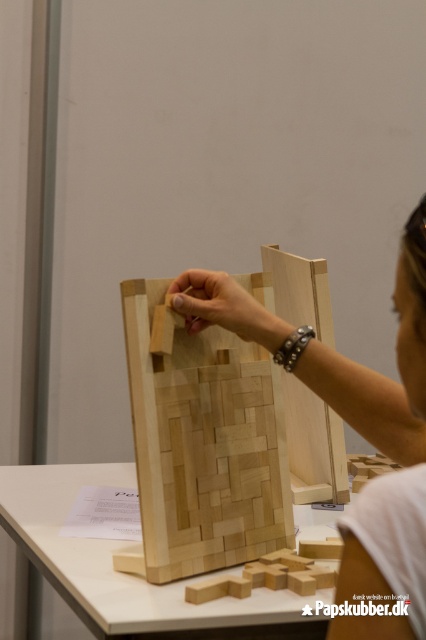
Can you confirm if natural wood puzzle piece at center is smaller than natural wood hand at center?

No, natural wood puzzle piece at center is not smaller than natural wood hand at center.

Is natural wood puzzle piece at center closer to camera compared to natural wood hand at center?

No.

Is point (261, 550) behind point (195, 323)?

Yes.

Image resolution: width=426 pixels, height=640 pixels. I want to click on natural wood puzzle piece at center, so click(x=201, y=442).